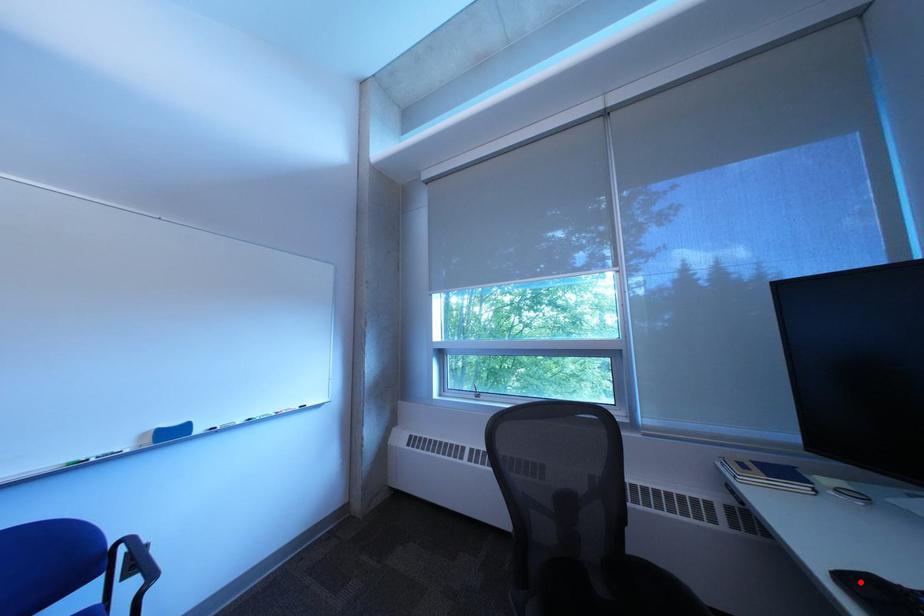
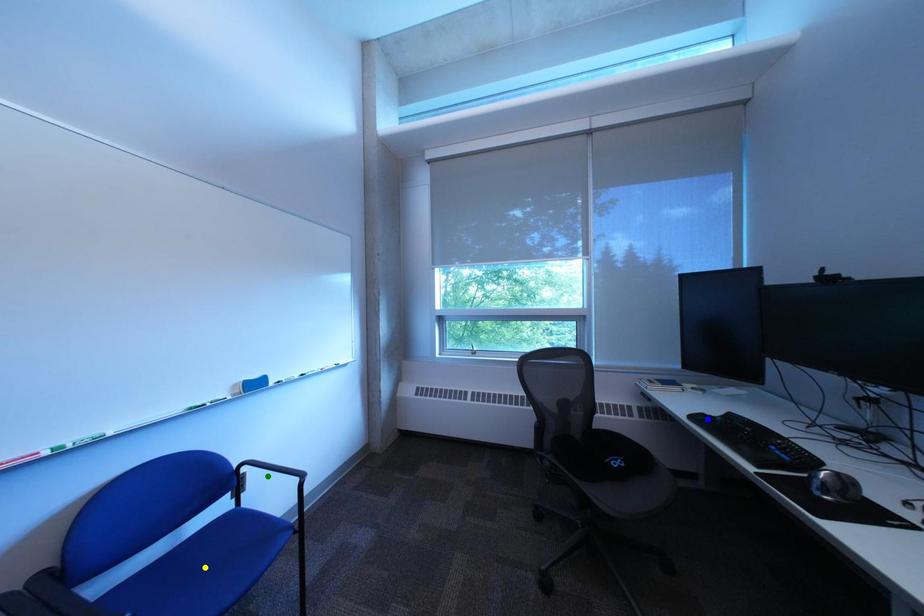
Question: I am providing you with two images of the same scene from different viewpoints. A red point is marked on the first image. You are given multiple points on the second image. Which spot in image 2 lines up with the point in image 1?

Choices:
 (A) yellow point
 (B) blue point
 (C) green point

Answer: (B)